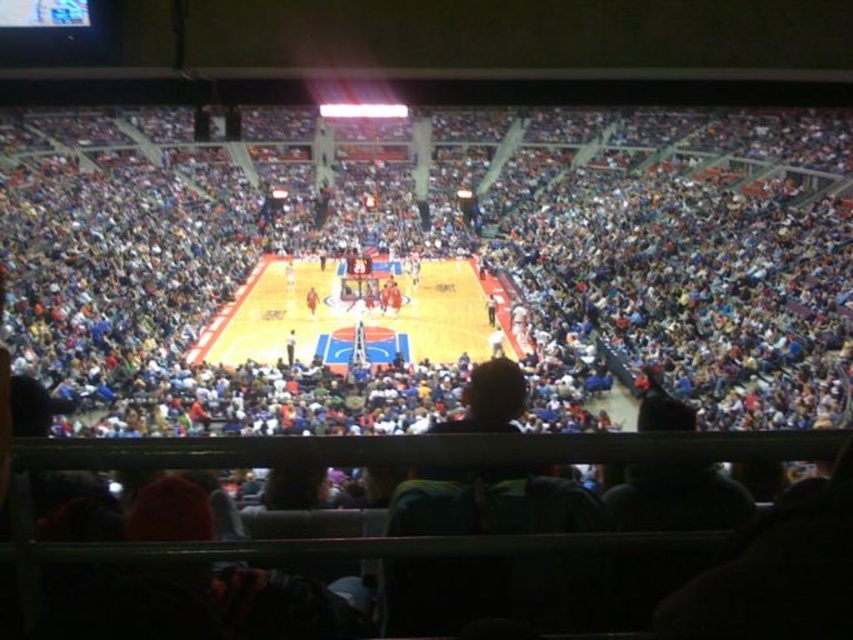
Question: Is wooden basketball court at center wider than orange jersey at center?

Choices:
 (A) yes
 (B) no

Answer: (A)

Question: Which point is farther from the camera taking this photo?

Choices:
 (A) (310, 298)
 (B) (426, 348)

Answer: (A)

Question: Is wooden basketball court at center bigger than orange jersey at center?

Choices:
 (A) no
 (B) yes

Answer: (B)

Question: Can you confirm if wooden basketball court at center is positioned to the left of orange jersey at center?

Choices:
 (A) no
 (B) yes

Answer: (A)

Question: Which point is farther to the camera?

Choices:
 (A) (314, 314)
 (B) (273, 353)

Answer: (A)